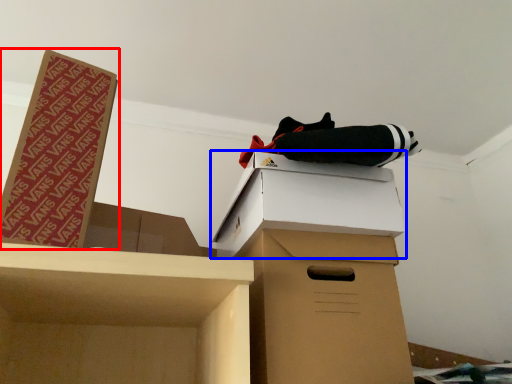
Question: Which object appears closest to the camera in this image, box (highlighted by a red box) or box (highlighted by a blue box)?

Choices:
 (A) box
 (B) box

Answer: (A)